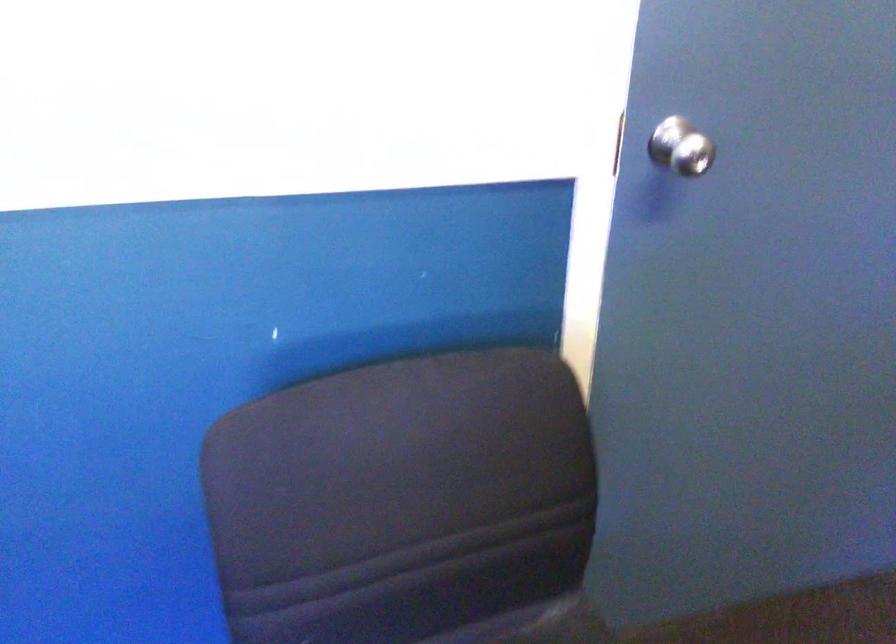
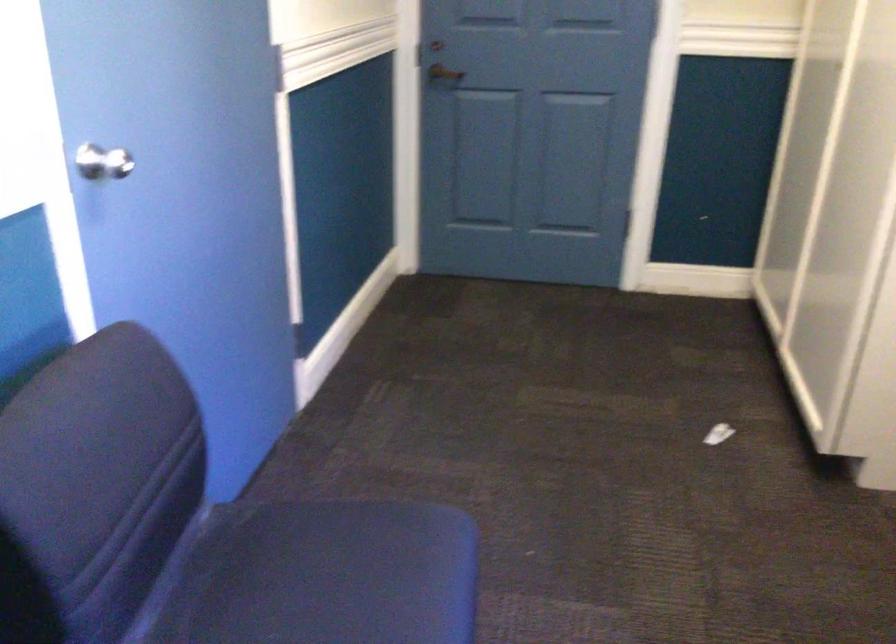
Question: The camera is either moving clockwise (left) or counter-clockwise (right) around the object. The first image is from the beginning of the video and the second image is from the end. Is the camera moving left or right when shooting the video?

Choices:
 (A) Left
 (B) Right

Answer: (A)